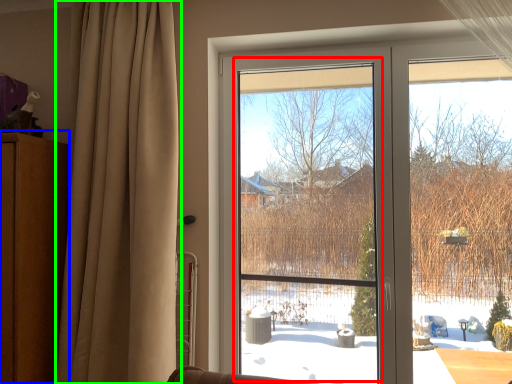
Question: Which is farther away from window screen (highlighted by a red box)? dresser (highlighted by a blue box) or curtain (highlighted by a green box)?

Choices:
 (A) dresser
 (B) curtain

Answer: (A)